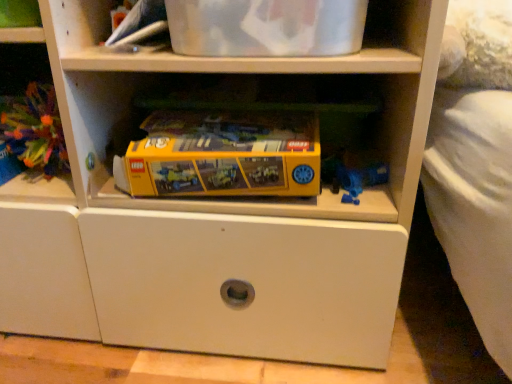
Question: Choose the correct answer: Is yellow plastic lego set at center, which appears as the 2th toy when viewed from the left, inside multicolored plastic toy at left, which is the second toy in right-to-left order, or outside it?

Choices:
 (A) inside
 (B) outside

Answer: (B)

Question: From a real-world perspective, relative to multicolored plastic toy at left, which is the second toy in right-to-left order, is yellow plastic lego set at center, the 1th toy when ordered from right to left, vertically above or below?

Choices:
 (A) above
 (B) below

Answer: (B)

Question: Is yellow plastic lego set at center, the 1th toy when ordered from right to left, in front of or behind multicolored plastic toy at left, which is the second toy in right-to-left order, in the image?

Choices:
 (A) front
 (B) behind

Answer: (A)

Question: Considering the positions of multicolored plastic toy at left, which is the second toy in right-to-left order, and yellow plastic lego set at center, which appears as the 2th toy when viewed from the left, in the image, is multicolored plastic toy at left, which is the second toy in right-to-left order, taller or shorter than yellow plastic lego set at center, which appears as the 2th toy when viewed from the left,?

Choices:
 (A) tall
 (B) short

Answer: (A)

Question: Is multicolored plastic toy at left, placed as the 1th toy when sorted from left to right, situated inside yellow plastic lego set at center, which appears as the 2th toy when viewed from the left, or outside?

Choices:
 (A) outside
 (B) inside

Answer: (A)

Question: From a real-world perspective, is multicolored plastic toy at left, placed as the 1th toy when sorted from left to right, above or below yellow plastic lego set at center, which appears as the 2th toy when viewed from the left?

Choices:
 (A) above
 (B) below

Answer: (A)

Question: Considering the positions of multicolored plastic toy at left, placed as the 1th toy when sorted from left to right, and yellow plastic lego set at center, the 1th toy when ordered from right to left, in the image, is multicolored plastic toy at left, placed as the 1th toy when sorted from left to right, bigger or smaller than yellow plastic lego set at center, the 1th toy when ordered from right to left,?

Choices:
 (A) small
 (B) big

Answer: (A)